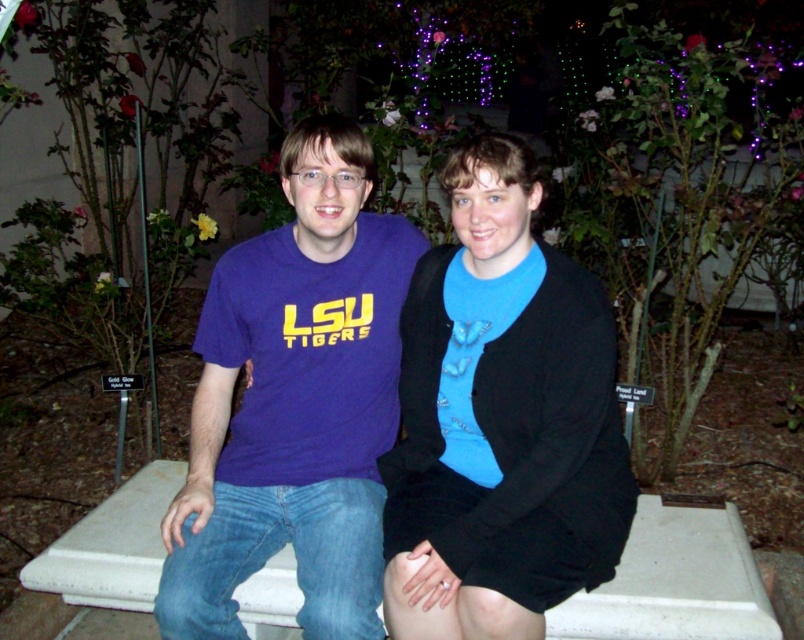
Between blue matte sweater at center and matte purple t-shirt at center, which one has less height?

blue matte sweater at center

Does point (534, 576) come farther from viewer compared to point (167, 612)?

No, it is not.

Locate an element on the screen. The width and height of the screenshot is (804, 640). blue matte sweater at center is located at coordinates (501, 420).